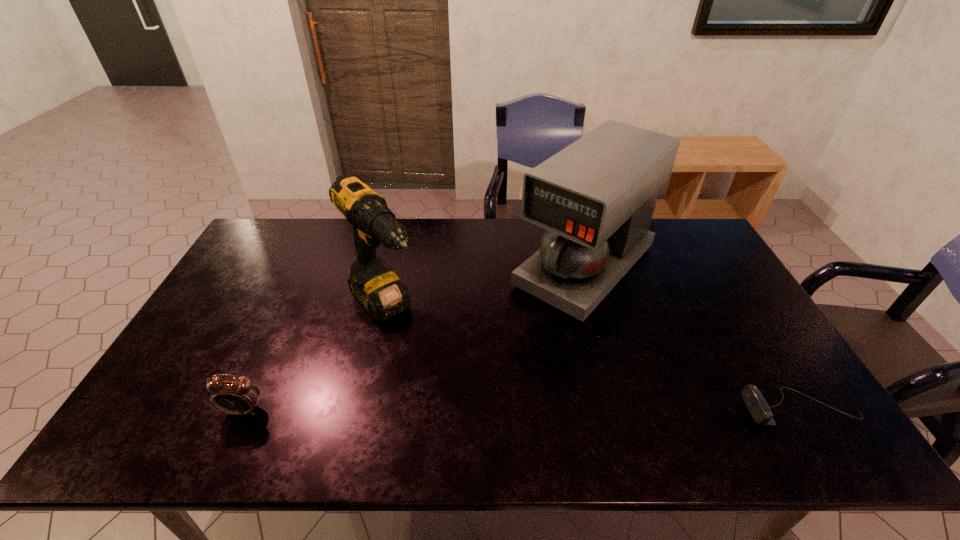
What are the coordinates of `free spot at the far edge of the desktop` in the screenshot? It's located at (481, 242).

Identify the location of vacant space at the near edge of the desktop. (354, 391).

Where is `vacant area at the left edge of the desktop`? The width and height of the screenshot is (960, 540). vacant area at the left edge of the desktop is located at coordinates (227, 334).

This screenshot has height=540, width=960. In the image, there is a desktop. In order to click on vacant space at the right edge in this screenshot , I will do `click(758, 340)`.

Where is `vacant region at the far right corner of the desktop`? This screenshot has height=540, width=960. vacant region at the far right corner of the desktop is located at coordinates (660, 234).

Where is `free area in between the alarm clock and the drill`? The height and width of the screenshot is (540, 960). free area in between the alarm clock and the drill is located at coordinates (315, 359).

Locate an element on the screen. The height and width of the screenshot is (540, 960). free point between the rightmost object and the drill is located at coordinates (592, 359).

Find the location of a particular element. vacant area between the coffee maker and the rightmost object is located at coordinates (692, 338).

This screenshot has width=960, height=540. Identify the location of unoccupied area between the third object from right to left and the second shortest object. (315, 359).

I want to click on free space between the second object from left to right and the alarm clock, so click(x=315, y=359).